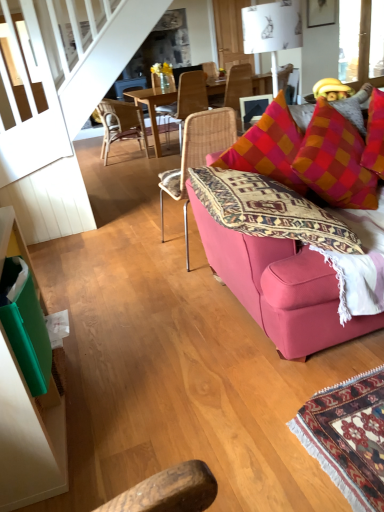
Question: From the image's perspective, does woven rattan chair at center, which appears as the 2th chair when viewed from the front, appear lower than white paper lampshade at upper center?

Choices:
 (A) yes
 (B) no

Answer: (B)

Question: Is woven rattan chair at center, which appears as the 2th chair when viewed from the front, oriented towards white paper lampshade at upper center?

Choices:
 (A) yes
 (B) no

Answer: (B)

Question: Can you confirm if woven rattan chair at center, which appears as the 2th chair when viewed from the front, is thinner than white paper lampshade at upper center?

Choices:
 (A) no
 (B) yes

Answer: (A)

Question: Considering the relative sizes of woven rattan chair at center, which is counted as the 3th chair, starting from the back, and white paper lampshade at upper center in the image provided, is woven rattan chair at center, which is counted as the 3th chair, starting from the back, bigger than white paper lampshade at upper center?

Choices:
 (A) yes
 (B) no

Answer: (A)

Question: Is woven rattan chair at center, which is counted as the 3th chair, starting from the back, taller than white paper lampshade at upper center?

Choices:
 (A) yes
 (B) no

Answer: (A)

Question: Does point (311, 159) appear closer or farther from the camera than point (261, 12)?

Choices:
 (A) farther
 (B) closer

Answer: (B)

Question: From the image's perspective, relative to white paper lampshade at upper center, is orange-red checkered throw pillow at upper right above or below?

Choices:
 (A) below
 (B) above

Answer: (A)

Question: Based on their sizes in the image, would you say orange-red checkered throw pillow at upper right is bigger or smaller than white paper lampshade at upper center?

Choices:
 (A) big
 (B) small

Answer: (A)

Question: Is orange-red checkered throw pillow at upper right taller or shorter than white paper lampshade at upper center?

Choices:
 (A) tall
 (B) short

Answer: (A)

Question: Is woven rattan chair at center, which appears as the 2th chair when viewed from the front, taller or shorter than orange-red checkered throw pillow at upper right?

Choices:
 (A) short
 (B) tall

Answer: (B)

Question: Is woven rattan chair at center, which is counted as the 3th chair, starting from the back, wider or thinner than orange-red checkered throw pillow at upper right?

Choices:
 (A) wide
 (B) thin

Answer: (A)

Question: Would you say woven rattan chair at center, which appears as the 2th chair when viewed from the front, is to the left or to the right of orange-red checkered throw pillow at upper right in the picture?

Choices:
 (A) left
 (B) right

Answer: (A)

Question: From a real-world perspective, relative to orange-red checkered throw pillow at upper right, is woven rattan chair at center, which is counted as the 3th chair, starting from the back, vertically above or below?

Choices:
 (A) below
 (B) above

Answer: (A)

Question: Is woven rattan chair at center, which appears as the 2th chair when viewed from the front, bigger or smaller than wooden textured chair at center, which appears as the fourth chair when viewed from the front?

Choices:
 (A) small
 (B) big

Answer: (B)

Question: From the image's perspective, is woven rattan chair at center, which appears as the 2th chair when viewed from the front, positioned above or below wooden textured chair at center, the 1th chair when ordered from back to front?

Choices:
 (A) above
 (B) below

Answer: (B)